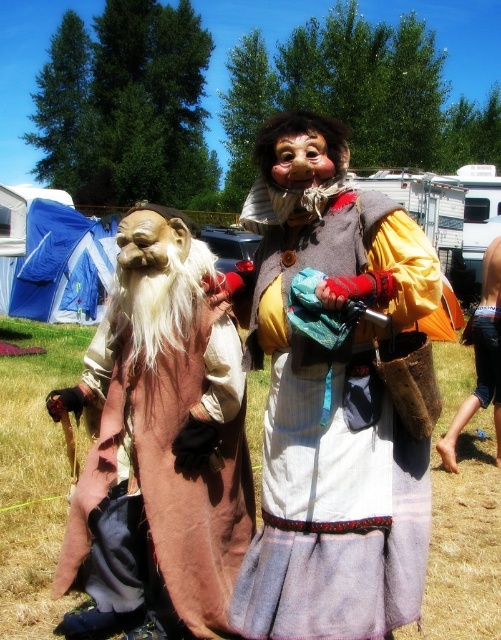
Question: Is matte brown mask at center to the right of matte brown mask at left from the viewer's perspective?

Choices:
 (A) yes
 (B) no

Answer: (A)

Question: Is orange fabric pants at lower right below matte brown mask at center?

Choices:
 (A) no
 (B) yes

Answer: (B)

Question: Which point appears closest to the camera in this image?

Choices:
 (A) (440, 444)
 (B) (148, 232)

Answer: (B)

Question: Which is farther from the matte brown mask at left?

Choices:
 (A) orange fabric pants at lower right
 (B) matte brown mask at center

Answer: (A)

Question: Does orange fabric pants at lower right have a greater width compared to matte brown mask at center?

Choices:
 (A) no
 (B) yes

Answer: (B)

Question: Which object appears closest to the camera in this image?

Choices:
 (A) worn fabric dress at center
 (B) matte brown mask at left

Answer: (A)